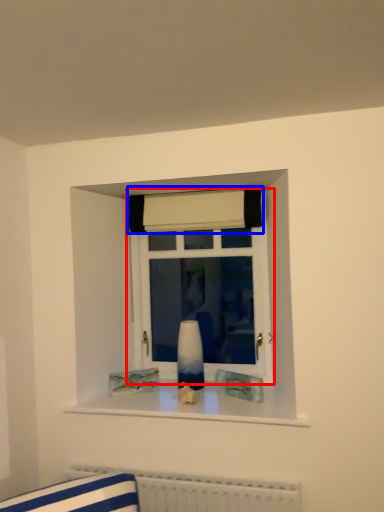
Question: Which object is further to the camera taking this photo, window (highlighted by a red box) or curtain (highlighted by a blue box)?

Choices:
 (A) window
 (B) curtain

Answer: (A)